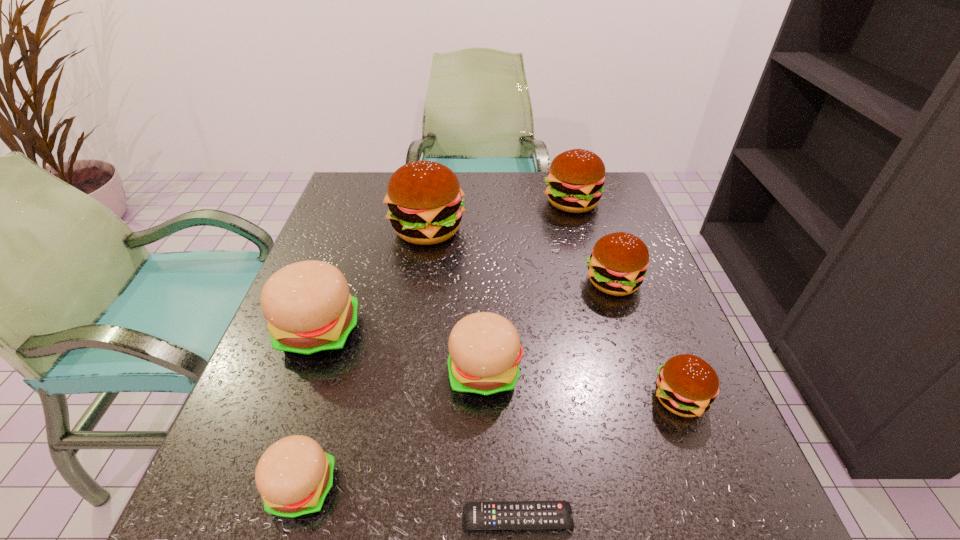
At what (x,y) coordinates should I click in order to perform the action: click on hamburger that is at the near edge. Please return your answer as a coordinate pair (x, y). Looking at the image, I should click on (294, 476).

Locate an element on the screen. This screenshot has height=540, width=960. remote control present at the near edge is located at coordinates (504, 515).

Find the location of a particular element. Image resolution: width=960 pixels, height=540 pixels. object at the near left corner is located at coordinates (294, 476).

What are the coordinates of `object located in the far right corner section of the desktop` in the screenshot? It's located at (575, 181).

Locate an element on the screen. This screenshot has height=540, width=960. free location at the far edge of the desktop is located at coordinates (498, 189).

In the image, there is a desktop. Identify the location of vacant region at the near edge. The height and width of the screenshot is (540, 960). (589, 488).

Locate an element on the screen. This screenshot has height=540, width=960. free location at the left edge is located at coordinates (291, 420).

In the image, there is a desktop. Where is `vacant area at the right edge`? Image resolution: width=960 pixels, height=540 pixels. vacant area at the right edge is located at coordinates coord(648,367).

Locate an element on the screen. The height and width of the screenshot is (540, 960). vacant space at the far right corner of the desktop is located at coordinates (587, 213).

This screenshot has height=540, width=960. I want to click on vacant space in between the shortest object and the nearest beige hamburger, so click(x=410, y=503).